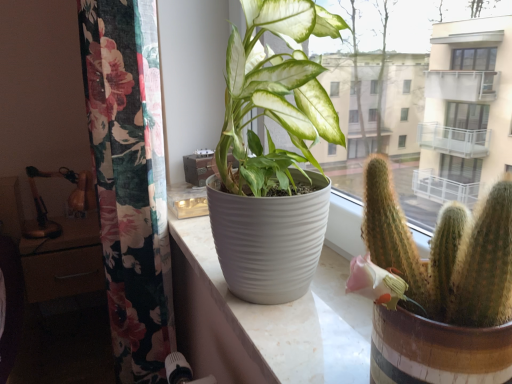
At what (x,y) coordinates should I click in order to perform the action: click on vacant area on top of white ribbed pot at center (from a real-world perspective). Please return your answer as a coordinate pair (x, y). The width and height of the screenshot is (512, 384). Looking at the image, I should click on (275, 301).